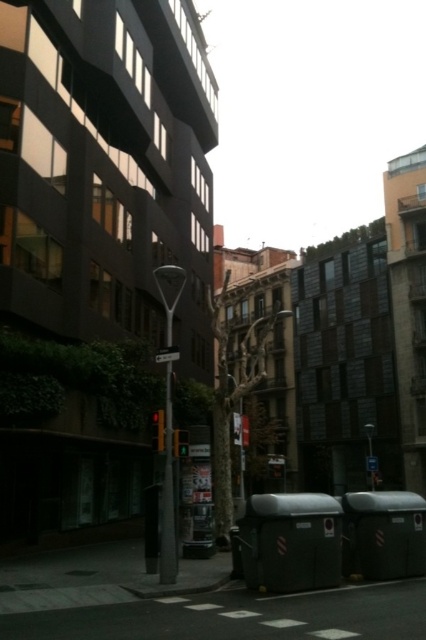
You are a pedestrian holding a 1.2 meter long ladder. You need to walk through the area between the metallic streetlight at center and the white plastic street sign at center. Can you pass through without tilting the ladder?

The metallic streetlight at center is positioned over the white plastic street sign at center, meaning there is no horizontal space between them. Therefore, you cannot pass through the area between them with a 1.2 meter ladder without tilting it.

You are a city planner assessing the urban space. You need to install a new bench that requires a 2 meter wide space. Given the brown textured tree at center and the metallic streetlight at center, which object might allow enough space for the bench if placed next to it?

The brown textured tree at center might be wider than the metallic streetlight at center. Therefore, the metallic streetlight at center might provide sufficient space for the bench since it is narrower.